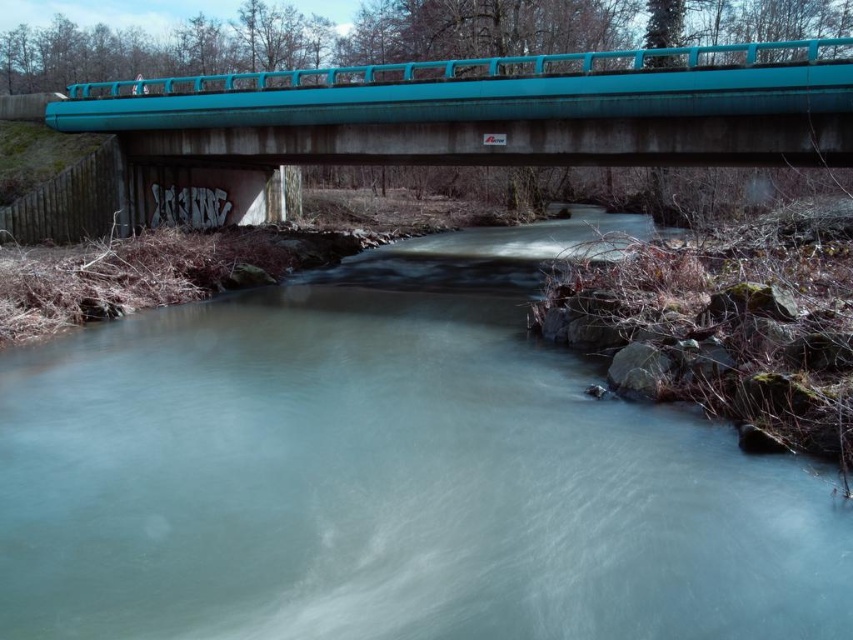
Question: Which of the following is the farthest from the observer?

Choices:
 (A) (846, 157)
 (B) (412, 536)

Answer: (A)

Question: Is the position of clear water at center more distant than that of teal concrete bridge at upper center?

Choices:
 (A) no
 (B) yes

Answer: (A)

Question: Which point is closer to the camera taking this photo?

Choices:
 (A) (508, 596)
 (B) (656, 68)

Answer: (A)

Question: Can you confirm if clear water at center is positioned to the right of teal concrete bridge at upper center?

Choices:
 (A) yes
 (B) no

Answer: (B)

Question: Can you confirm if clear water at center is wider than teal concrete bridge at upper center?

Choices:
 (A) yes
 (B) no

Answer: (B)